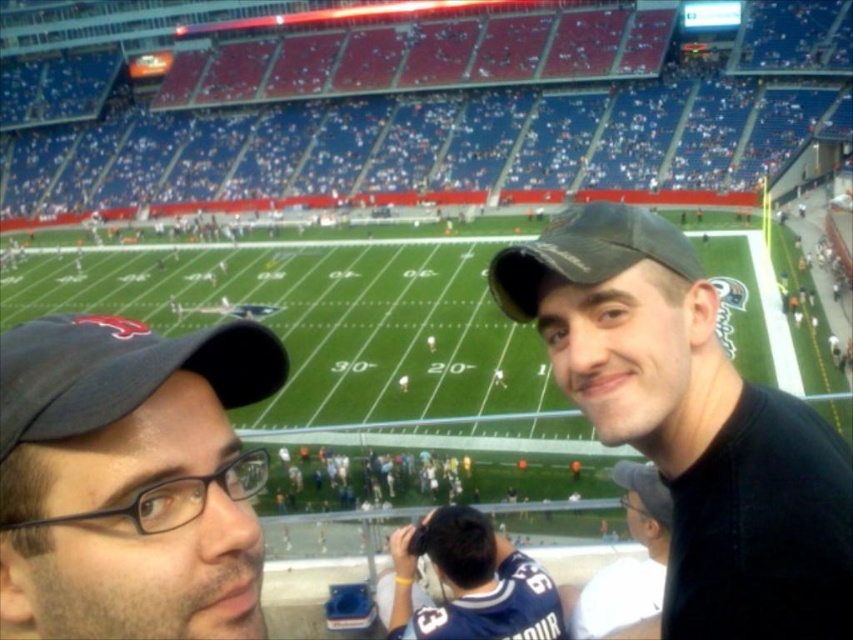
You are a photographer at the stadium and want to take a photo of both the matte black baseball cap at left and the blue jersey at center. Since you need to ensure both are fully visible, which object should you focus on first to avoid blurring due to their height difference?

The matte black baseball cap at left has a lesser height compared to blue jersey at center, so you should focus on the blue jersey at center first as it is taller and might require more precise focusing to ensure clarity.

What object is located at the coordinates point [691,424] in the image?

A: The point [691,424] marks the black matte cap at upper right.